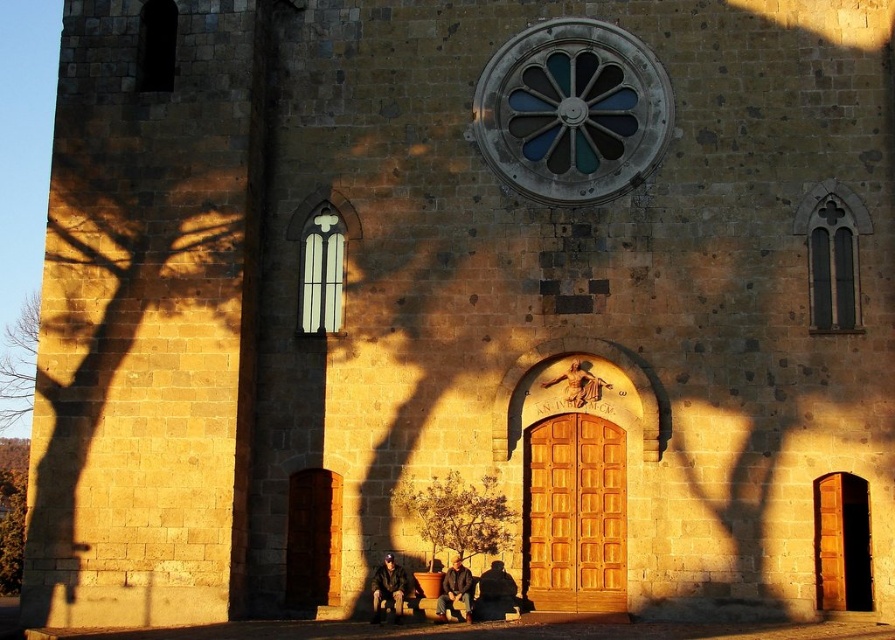
Question: Estimate the real-world distances between objects in this image. Which object is farther from the brown leather jacket at lower center?

Choices:
 (A) stained glass window at upper center
 (B) leather jacket at lower center
 (C) polished bronze statue at center

Answer: (A)

Question: Which object is the closest to the leather jacket at lower center?

Choices:
 (A) stained glass window at upper center
 (B) dark brown leather jacket at lower center
 (C) wooden door at center
 (D) polished bronze statue at center

Answer: (B)

Question: Among these objects, which one is farthest from the camera?

Choices:
 (A) polished bronze statue at center
 (B) leather jacket at lower center

Answer: (A)

Question: Is stained glass window at upper center below brown leather jacket at lower center?

Choices:
 (A) no
 (B) yes

Answer: (A)

Question: Can you confirm if dark brown leather jacket at lower center is positioned to the right of leather jacket at lower center?

Choices:
 (A) no
 (B) yes

Answer: (B)

Question: Is wooden door at center to the left of leather jacket at lower center from the viewer's perspective?

Choices:
 (A) yes
 (B) no

Answer: (B)